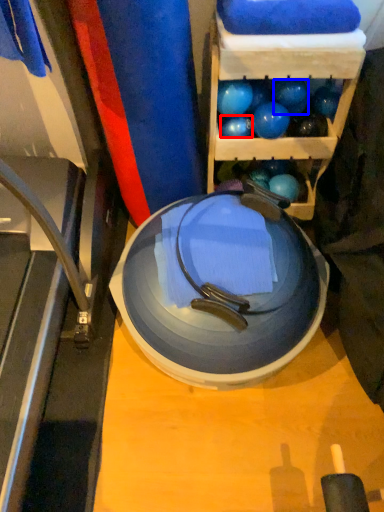
Question: Which of the following is the farthest to the observer, ball (highlighted by a red box) or ball (highlighted by a blue box)?

Choices:
 (A) ball
 (B) ball

Answer: (A)